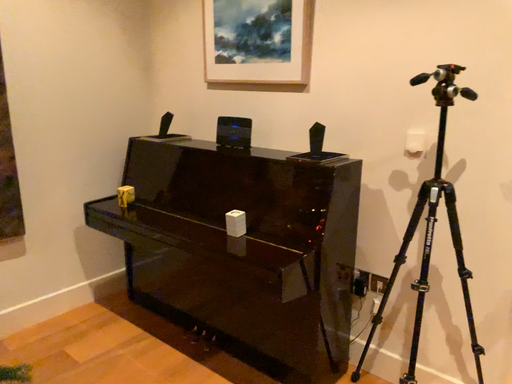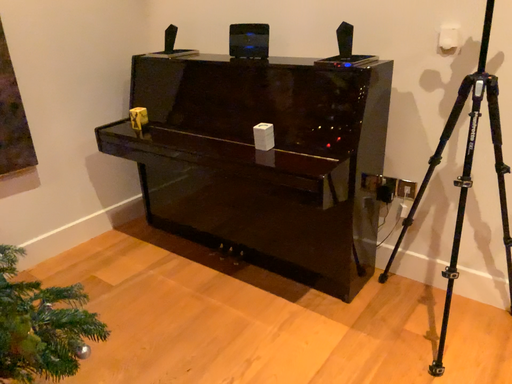
Question: Which way did the camera rotate in the video?

Choices:
 (A) rotated downward
 (B) rotated upward

Answer: (A)